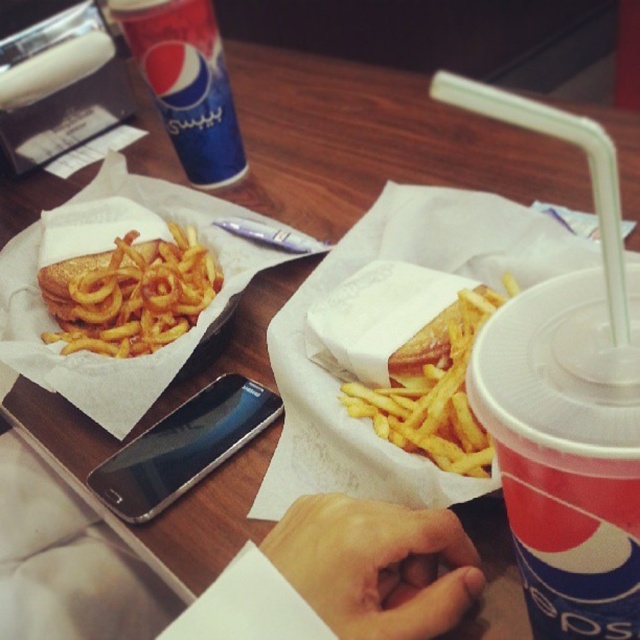
Which is behind, point (195, 236) or point (397, 392)?

Positioned behind is point (195, 236).

Does golden crispy french fries at left appear on the left side of golden crispy french fries at center?

Yes, golden crispy french fries at left is to the left of golden crispy french fries at center.

Is point (156, 328) more distant than point (400, 376)?

Yes, it is behind point (400, 376).

In order to click on golden crispy french fries at left in this screenshot , I will do `click(129, 292)`.

Image resolution: width=640 pixels, height=640 pixels. What do you see at coordinates (566, 451) in the screenshot? I see `translucent plastic cup with straw at center right` at bounding box center [566, 451].

Is translucent plastic cup with straw at center right bigger than golden crispy french fries at left?

No.

Is point (547, 372) behind point (154, 280)?

No, it is in front of (154, 280).

Find the location of `translucent plastic cup with straw at center right`. translucent plastic cup with straw at center right is located at coordinates (566, 451).

Is point (557, 497) in front of point (202, 413)?

Yes, it is in front of point (202, 413).

Does translucent plastic cup with straw at center right appear under black glossy smartphone at center?

No.

Measure the distance between translucent plastic cup with straw at center right and camera.

A distance of 8.74 inches exists between translucent plastic cup with straw at center right and camera.

The height and width of the screenshot is (640, 640). Find the location of `translucent plastic cup with straw at center right`. translucent plastic cup with straw at center right is located at coordinates (566, 451).